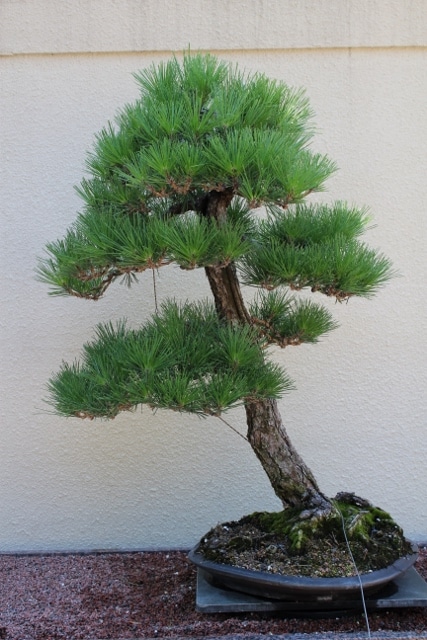
You are a GUI agent. You are given a task and a screenshot of the screen. Output one action in this format:
    pyautogui.click(x=<x>, y=<y>)
    Task: Click on the pot
    Image resolution: width=427 pixels, height=640 pixels.
    Given the screenshot: What is the action you would take?
    pyautogui.click(x=204, y=561), pyautogui.click(x=326, y=582), pyautogui.click(x=395, y=570)